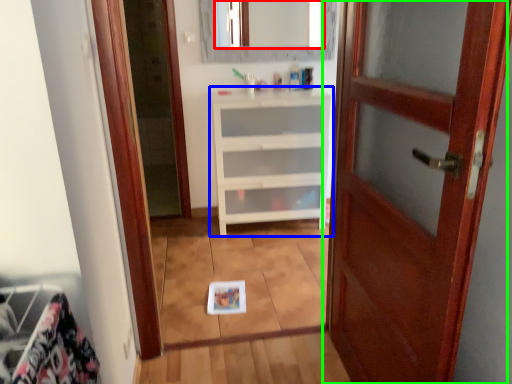
Question: Estimate the real-world distances between objects in this image. Which object is closer to mirror (highlighted by a red box), chest of drawers (highlighted by a blue box) or door (highlighted by a green box)?

Choices:
 (A) chest of drawers
 (B) door

Answer: (A)